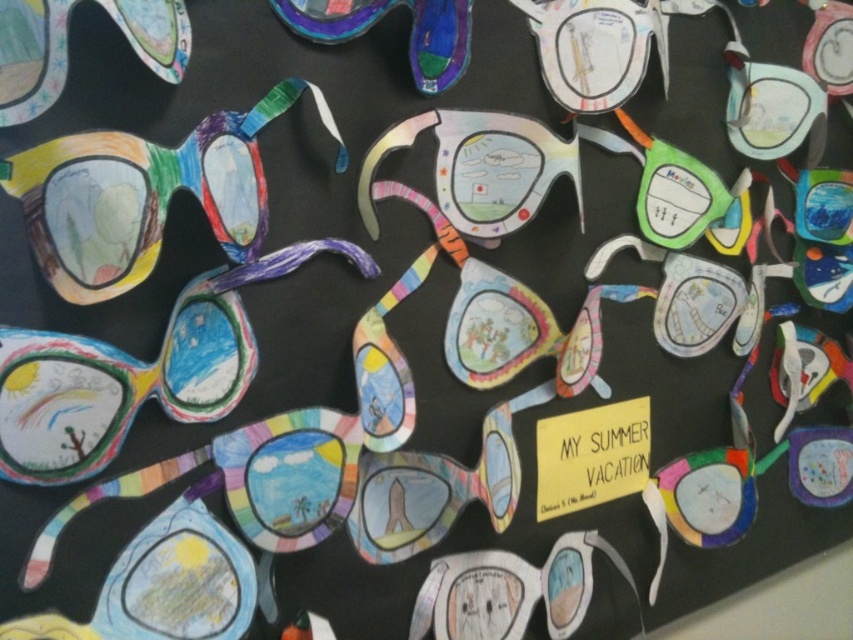
Question: Estimate the real-world distances between objects in this image. Which object is closer to the matte paper goggles at center?

Choices:
 (A) pastel rainbow sunglasses at center
 (B) matte multicolored goggles at left
 (C) matte white goggles at upper center
 (D) matte blue goggles at upper center

Answer: (A)

Question: Is pastel rainbow sunglasses at center to the right of matte paper goggles at upper left from the viewer's perspective?

Choices:
 (A) no
 (B) yes

Answer: (B)

Question: Estimate the real-world distances between objects in this image. Which object is closer to the matte multicolored goggles at left?

Choices:
 (A) matte paper sunglasses at left
 (B) matte green sunglasses at center
 (C) matte blue goggles at upper center
 (D) matte paper goggles at upper left

Answer: (A)

Question: Is pastel rainbow sunglasses at center above matte blue goggles at upper center?

Choices:
 (A) no
 (B) yes

Answer: (A)

Question: Which object is the closest to the pastel rainbow sunglasses at center?

Choices:
 (A) matte white goggles at upper center
 (B) matte green sunglasses at center
 (C) matte paper goggles at upper left
 (D) matte paper sunglasses at left

Answer: (A)

Question: Can you confirm if pastel rainbow sunglasses at center is positioned above matte green sunglasses at center?

Choices:
 (A) yes
 (B) no

Answer: (B)